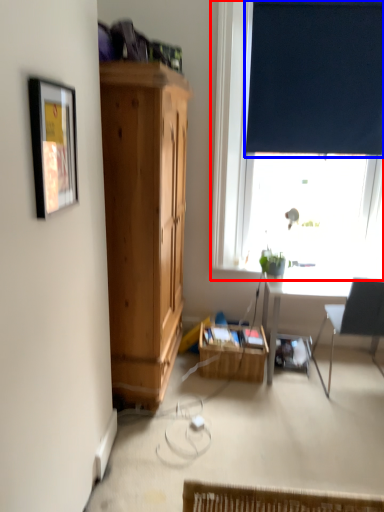
Question: Among these objects, which one is nearest to the camera, window (highlighted by a red box) or curtain (highlighted by a blue box)?

Choices:
 (A) window
 (B) curtain

Answer: (A)